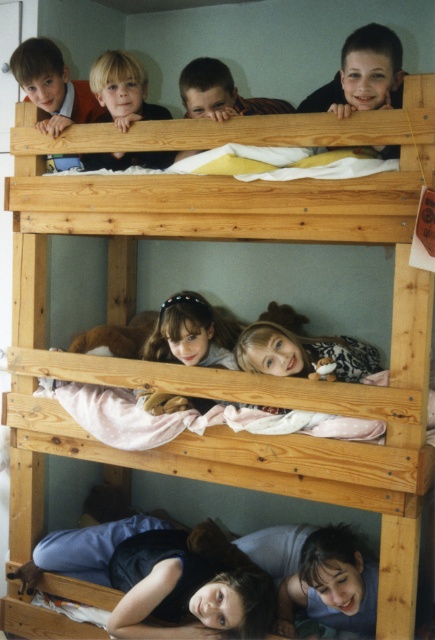
Does dark blue fabric at lower center lie in front of blonde hair at upper left?

Yes, it is in front of blonde hair at upper left.

In the scene shown: Which is more to the left, dark blue fabric at lower center or blonde hair at upper left?

blonde hair at upper left

Who is more forward, (210,627) or (134,92)?

Positioned in front is point (210,627).

In order to click on dark blue fabric at lower center in this screenshot , I will do `click(160, 577)`.

Between point (129, 554) and point (157, 333), which one is positioned in front?

Point (129, 554)

Is point (144, 529) more distant than point (159, 317)?

Yes, it is behind point (159, 317).

Is point (113, 548) farther from camera compared to point (214, 328)?

Yes, it is behind point (214, 328).

What are the coordinates of `dark blue fabric at lower center` in the screenshot? It's located at (160, 577).

Does light brown hairband at center come in front of blonde hair at upper left?

No, light brown hairband at center is behind blonde hair at upper left.

Who is more distant from viewer, (184, 353) or (147, 166)?

The point (147, 166) is more distant.

Is point (191, 330) in front of point (100, 104)?

Yes, point (191, 330) is in front of point (100, 104).

At what (x,y) coordinates should I click in order to perform the action: click on light brown hairband at center. Please return your answer as a coordinate pair (x, y). This screenshot has width=435, height=640. Looking at the image, I should click on (x=190, y=333).